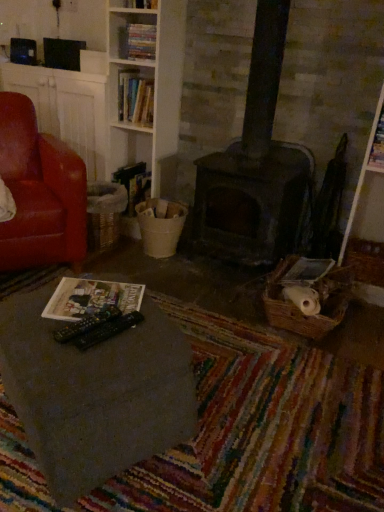
Identify the location of free location above matte paper magazine at lower left, which ranks as the second magazine in back-to-front order (from a real-world perspective). (100, 295).